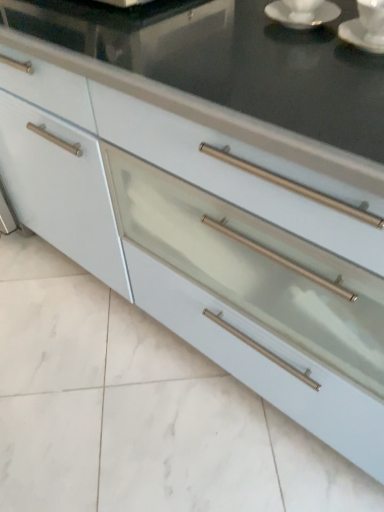
Locate an element on the screen. The height and width of the screenshot is (512, 384). free space to the left of white glossy saucer at upper right is located at coordinates (212, 25).